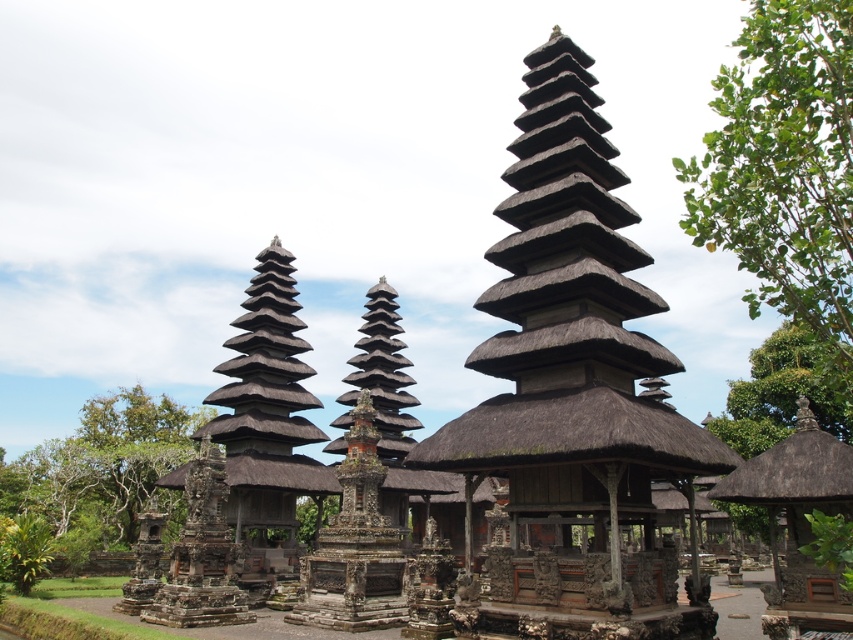
Which of these two, dark brown thatched roof tower at center or green leafy tree at lower left, stands shorter?

green leafy tree at lower left

Is dark brown thatched roof tower at center closer to the viewer compared to green leafy tree at lower left?

That is True.

Identify the location of dark brown thatched roof tower at center. The image size is (853, 640). (573, 392).

Locate an element on the screen. dark brown thatched roof tower at center is located at coordinates (573, 392).